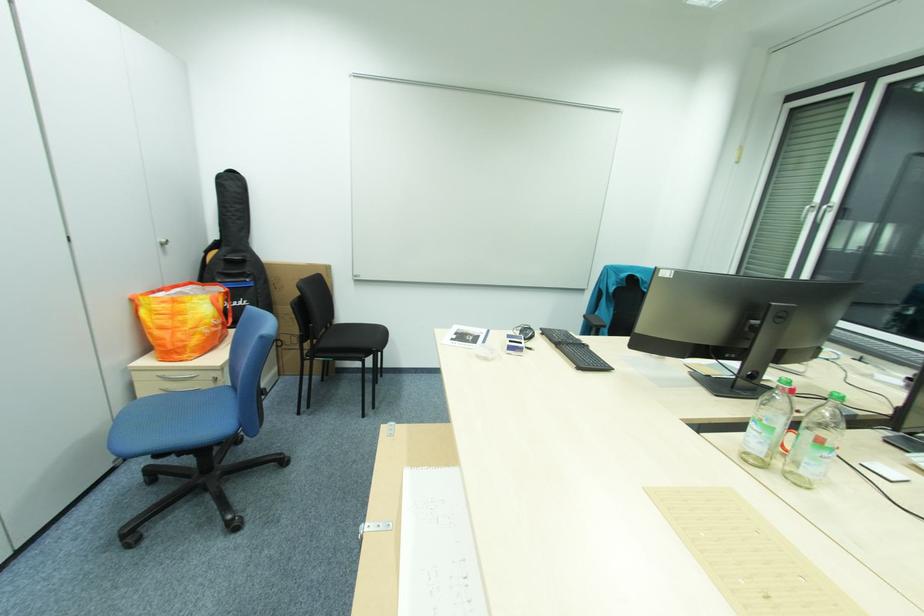
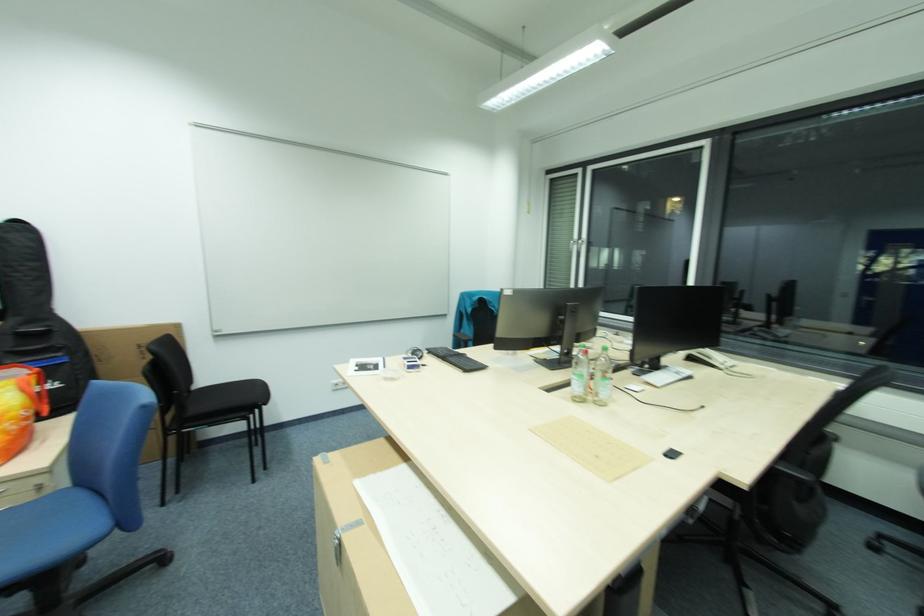
In the second image, find the point that corresponds to point (241, 252) in the first image.

(41, 322)